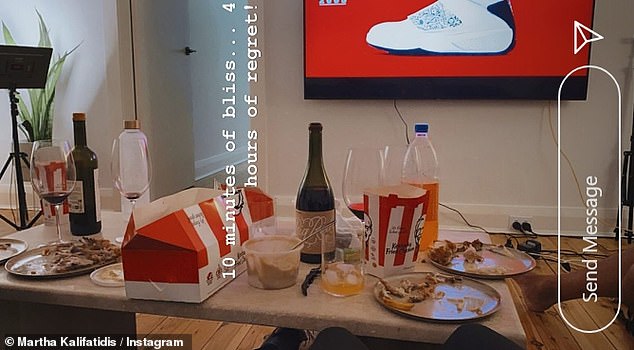
At what (x,y) coordinates should I click in order to perform the action: click on outlet. Please return your answer as a coordinate pair (x, y). The image size is (634, 350). Looking at the image, I should click on (526, 223).